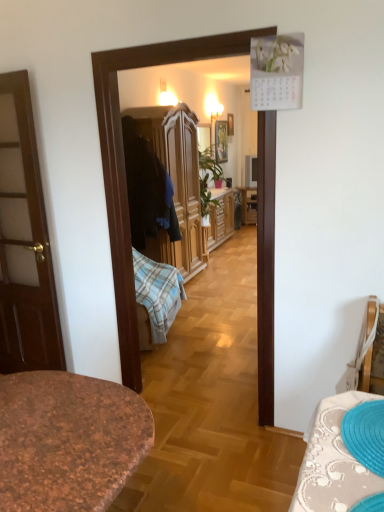
In order to face matte black television at center, should I rotate leftwards or rightwards?

Rotate your view right by about 7.926°.

Locate an element on the screen. The width and height of the screenshot is (384, 512). wooden picture frame at upper center, which ranks as the first picture frame in right-to-left order is located at coordinates (230, 124).

What do you see at coordinates (230, 124) in the screenshot? The width and height of the screenshot is (384, 512). I see `wooden picture frame at upper center, which ranks as the second picture frame in left-to-right order` at bounding box center [230, 124].

Locate an element on the screen. This screenshot has height=512, width=384. wooden picture frame at center, which appears as the 2th picture frame when viewed from the right is located at coordinates (221, 141).

Is wooden wardrobe at center at the left side of matte black television at center?

Yes, wooden wardrobe at center is to the left of matte black television at center.

Where is `cabinetry above the matte black television at center (from a real-world perspective)`? cabinetry above the matte black television at center (from a real-world perspective) is located at coordinates (177, 181).

Is wooden wardrobe at center looking in the opposite direction of matte black television at center?

No, matte black television at center is not at the back of wooden wardrobe at center.

Is the position of wooden wardrobe at center more distant than that of matte black television at center?

No, wooden wardrobe at center is closer to the viewer.

From a real-world perspective, between wooden wardrobe at center and wooden picture frame at center, marked as the 1th picture frame in a left-to-right arrangement, who is vertically lower?

wooden wardrobe at center is physically lower.

From the image's perspective, would you say wooden wardrobe at center is shown under wooden picture frame at center, which appears as the 2th picture frame when viewed from the right?

Yes, from the image's perspective, wooden wardrobe at center is beneath wooden picture frame at center, which appears as the 2th picture frame when viewed from the right.

Is wooden wardrobe at center wider than wooden picture frame at center, marked as the 1th picture frame in a left-to-right arrangement?

Indeed, wooden wardrobe at center has a greater width compared to wooden picture frame at center, marked as the 1th picture frame in a left-to-right arrangement.

What's the angular difference between wooden wardrobe at center and wooden picture frame at upper center, which ranks as the second picture frame in left-to-right order,'s facing directions?

4.27 degrees.

Considering the sizes of wooden wardrobe at center and wooden picture frame at upper center, which ranks as the first picture frame in right-to-left order, in the image, is wooden wardrobe at center taller or shorter than wooden picture frame at upper center, which ranks as the first picture frame in right-to-left order,?

wooden wardrobe at center is taller than wooden picture frame at upper center, which ranks as the first picture frame in right-to-left order.

The image size is (384, 512). I want to click on cabinetry in front of the wooden picture frame at upper center, which ranks as the second picture frame in left-to-right order, so click(177, 181).

In the scene shown: Choose the correct answer: Is matte black television at center inside wooden picture frame at center, marked as the 1th picture frame in a left-to-right arrangement, or outside it?

matte black television at center is located beyond the bounds of wooden picture frame at center, marked as the 1th picture frame in a left-to-right arrangement.

Is point (248, 185) closer to camera compared to point (226, 135)?

No, it is not.

Is matte black television at center positioned far away from wooden picture frame at center, marked as the 1th picture frame in a left-to-right arrangement?

matte black television at center is near wooden picture frame at center, marked as the 1th picture frame in a left-to-right arrangement, not far away.

Which object is thinner, matte black television at center or wooden picture frame at upper center, which ranks as the first picture frame in right-to-left order?

With smaller width is wooden picture frame at upper center, which ranks as the first picture frame in right-to-left order.

Is matte black television at center situated inside wooden picture frame at upper center, which ranks as the second picture frame in left-to-right order, or outside?

matte black television at center is located beyond the bounds of wooden picture frame at upper center, which ranks as the second picture frame in left-to-right order.

Is point (252, 187) closer to camera compared to point (233, 128)?

No.

Could you tell me if matte black television at center is facing wooden picture frame at upper center, which ranks as the second picture frame in left-to-right order?

No, matte black television at center is not aimed at wooden picture frame at upper center, which ranks as the second picture frame in left-to-right order.

From a real-world perspective, relative to matte black television at center, is wooden picture frame at upper center, which ranks as the second picture frame in left-to-right order, vertically above or below?

wooden picture frame at upper center, which ranks as the second picture frame in left-to-right order, is above matte black television at center.

Is wooden picture frame at upper center, which ranks as the first picture frame in right-to-left order, turned away from matte black television at center?

No.

How many degrees apart are the facing directions of wooden picture frame at upper center, which ranks as the first picture frame in right-to-left order, and matte black television at center?

65.7 degrees separate the facing orientations of wooden picture frame at upper center, which ranks as the first picture frame in right-to-left order, and matte black television at center.

In the image, is wooden picture frame at center, which appears as the 2th picture frame when viewed from the right, positioned in front of or behind wooden picture frame at upper center, which ranks as the first picture frame in right-to-left order?

wooden picture frame at center, which appears as the 2th picture frame when viewed from the right, is positioned closer to the viewer than wooden picture frame at upper center, which ranks as the first picture frame in right-to-left order.

From a real-world perspective, is wooden picture frame at center, which appears as the 2th picture frame when viewed from the right, over wooden picture frame at upper center, which ranks as the second picture frame in left-to-right order?

Actually, wooden picture frame at center, which appears as the 2th picture frame when viewed from the right, is physically below wooden picture frame at upper center, which ranks as the second picture frame in left-to-right order, in the real world.

Considering the relative sizes of wooden picture frame at center, marked as the 1th picture frame in a left-to-right arrangement, and wooden picture frame at upper center, which ranks as the second picture frame in left-to-right order, in the image provided, is wooden picture frame at center, marked as the 1th picture frame in a left-to-right arrangement, taller than wooden picture frame at upper center, which ranks as the second picture frame in left-to-right order,?

Yes.

Is wooden picture frame at center, which appears as the 2th picture frame when viewed from the right, aimed at wooden picture frame at upper center, which ranks as the first picture frame in right-to-left order?

No.

At what (x,y) coordinates should I click in order to perform the action: click on cabinetry located in front of the matte black television at center. Please return your answer as a coordinate pair (x, y). Looking at the image, I should click on (177, 181).

You are a GUI agent. You are given a task and a screenshot of the screen. Output one action in this format:
    pyautogui.click(x=<x>, y=<y>)
    Task: Click on the cabinetry that appears on the left of wooden picture frame at center, marked as the 1th picture frame in a left-to-right arrangement
    The image size is (384, 512).
    Given the screenshot: What is the action you would take?
    pyautogui.click(x=177, y=181)

Considering their positions, is wooden wardrobe at center positioned further to matte black television at center than wooden picture frame at upper center, which ranks as the first picture frame in right-to-left order?

Based on the image, wooden wardrobe at center appears to be further to matte black television at center.

When comparing their distances from wooden picture frame at upper center, which ranks as the second picture frame in left-to-right order, does matte black television at center or wooden picture frame at center, which appears as the 2th picture frame when viewed from the right, seem further?

matte black television at center lies further to wooden picture frame at upper center, which ranks as the second picture frame in left-to-right order, than the other object.

Looking at this image, from the image, which object appears to be farther from wooden wardrobe at center, wooden picture frame at upper center, which ranks as the first picture frame in right-to-left order, or matte black television at center?

wooden picture frame at upper center, which ranks as the first picture frame in right-to-left order, is positioned further to the anchor wooden wardrobe at center.

Which object lies nearer to the anchor point wooden wardrobe at center, matte black television at center or wooden picture frame at center, which appears as the 2th picture frame when viewed from the right?

wooden picture frame at center, which appears as the 2th picture frame when viewed from the right, is positioned closer to the anchor wooden wardrobe at center.

Which object lies nearer to the anchor point wooden picture frame at upper center, which ranks as the second picture frame in left-to-right order, wooden wardrobe at center or wooden picture frame at center, marked as the 1th picture frame in a left-to-right arrangement?

The object closer to wooden picture frame at upper center, which ranks as the second picture frame in left-to-right order, is wooden picture frame at center, marked as the 1th picture frame in a left-to-right arrangement.

Looking at this image, based on their spatial positions, is matte black television at center or wooden picture frame at upper center, which ranks as the first picture frame in right-to-left order, further from wooden wardrobe at center?

wooden picture frame at upper center, which ranks as the first picture frame in right-to-left order, is further to wooden wardrobe at center.

Based on their spatial positions, is wooden picture frame at center, which appears as the 2th picture frame when viewed from the right, or wooden wardrobe at center closer to wooden picture frame at upper center, which ranks as the first picture frame in right-to-left order?

Based on the image, wooden picture frame at center, which appears as the 2th picture frame when viewed from the right, appears to be nearer to wooden picture frame at upper center, which ranks as the first picture frame in right-to-left order.

Consider the image. Which object lies further to the anchor point matte black television at center, wooden picture frame at center, marked as the 1th picture frame in a left-to-right arrangement, or wooden picture frame at upper center, which ranks as the second picture frame in left-to-right order?

wooden picture frame at upper center, which ranks as the second picture frame in left-to-right order.

Where is `picture frame between wooden picture frame at upper center, which ranks as the first picture frame in right-to-left order, and matte black television at center from top to bottom`? picture frame between wooden picture frame at upper center, which ranks as the first picture frame in right-to-left order, and matte black television at center from top to bottom is located at coordinates (221, 141).

The height and width of the screenshot is (512, 384). In order to click on picture frame between wooden wardrobe at center and matte black television at center in the front-back direction in this screenshot , I will do `click(221, 141)`.

You are a GUI agent. You are given a task and a screenshot of the screen. Output one action in this format:
    pyautogui.click(x=<x>, y=<y>)
    Task: Click on the picture frame between wooden wardrobe at center and wooden picture frame at upper center, which ranks as the second picture frame in left-to-right order, along the z-axis
    The height and width of the screenshot is (512, 384).
    Given the screenshot: What is the action you would take?
    pyautogui.click(x=221, y=141)

At what (x,y) coordinates should I click in order to perform the action: click on television between wooden wardrobe at center and wooden picture frame at upper center, which ranks as the first picture frame in right-to-left order, in the front-back direction. Please return your answer as a coordinate pair (x, y). This screenshot has height=512, width=384. Looking at the image, I should click on (251, 170).